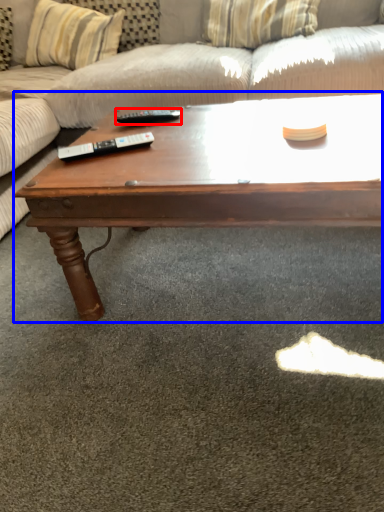
Question: Among these objects, which one is nearest to the camera, remote (highlighted by a red box) or coffee table (highlighted by a blue box)?

Choices:
 (A) remote
 (B) coffee table

Answer: (B)